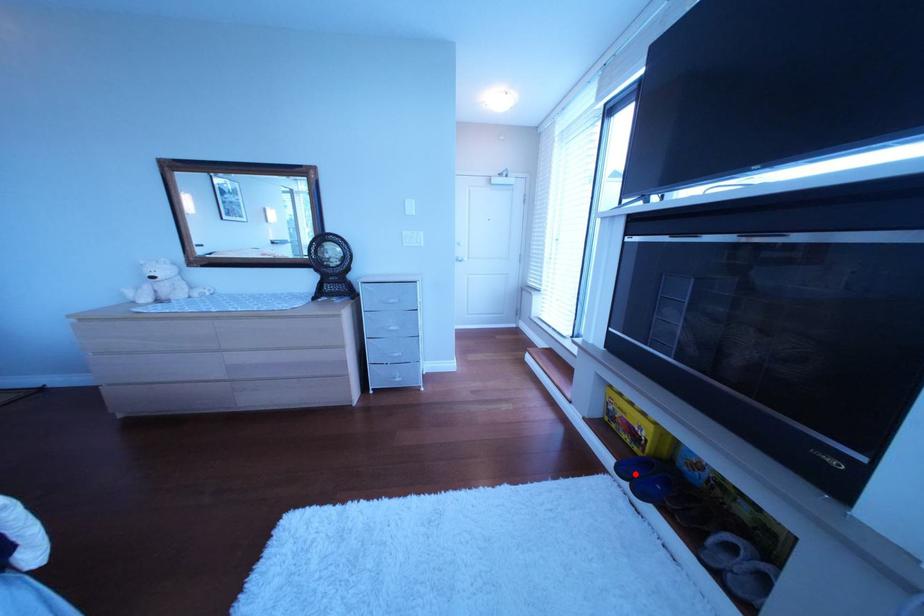
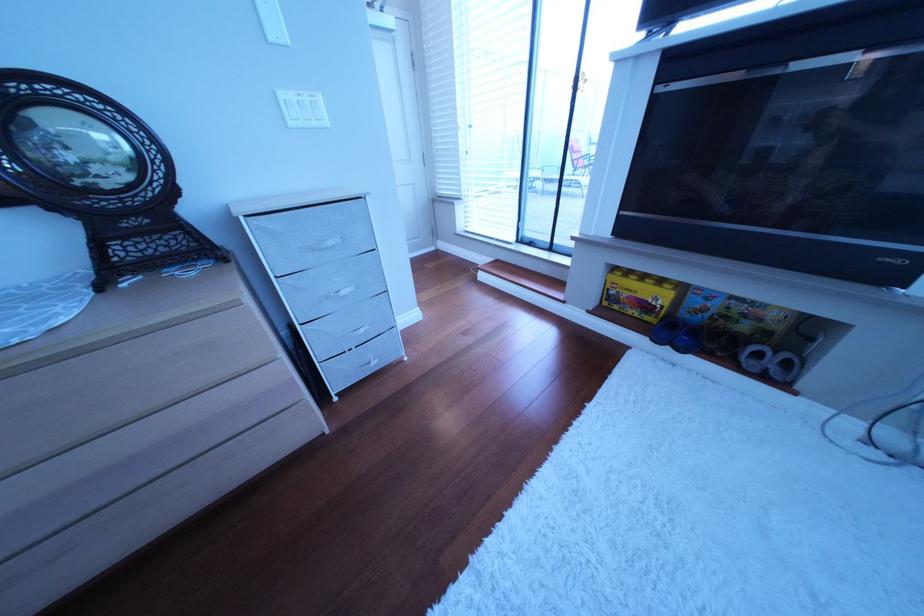
Find the pixel in the second image that matches the highlighted location in the first image.

(673, 342)